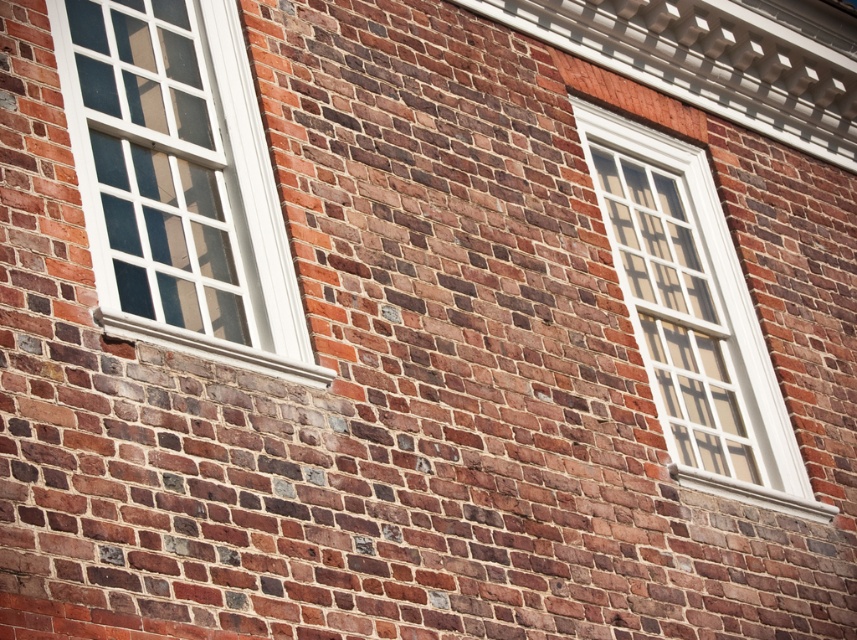
You are an architect assessing the facade of a historic building. You notice two windows on the brick wall. The first is the white wood window at left, and the second is the white glass window at upper right. Based on their positions and sizes, which window would require a taller opening in the brick wall?

The white glass window at upper right requires a taller opening in the brick wall because it is taller than the white wood window at left.

You are standing in front of a historic building with a brick wall. You notice two windows on the wall. One is a white wood window at left and the other is a white glass window at upper right. From your perspective, which window is positioned more to the left?

The white wood window at left is positioned more to the left than the white glass window at upper right.

You are standing in front of a historic building with a brick wall. You see a white wood window at left and a white glass window at upper right. Which window is positioned higher on the wall?

The white wood window at left is located above the white glass window at upper right, so it is positioned higher on the wall.